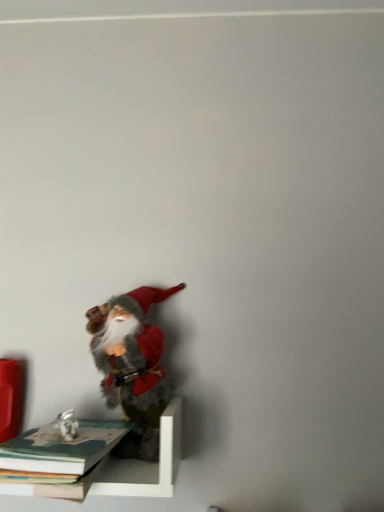
Question: From a real-world perspective, does fuzzy felt santa at lower left stand above hardcover book at lower left, positioned as the first book in bottom-to-top order?

Choices:
 (A) yes
 (B) no

Answer: (A)

Question: From the image's perspective, would you say fuzzy felt santa at lower left is positioned over hardcover book at lower left, positioned as the first book in bottom-to-top order?

Choices:
 (A) yes
 (B) no

Answer: (A)

Question: Can you confirm if fuzzy felt santa at lower left is taller than hardcover book at lower left, positioned as the first book in bottom-to-top order?

Choices:
 (A) no
 (B) yes

Answer: (B)

Question: Is fuzzy felt santa at lower left closer to camera compared to hardcover book at lower left, which is the second book from top to bottom?

Choices:
 (A) yes
 (B) no

Answer: (B)

Question: Is the position of fuzzy felt santa at lower left more distant than that of hardcover book at lower left, which is the second book from top to bottom?

Choices:
 (A) no
 (B) yes

Answer: (B)

Question: Looking at the image, does fuzzy felt santa at lower left seem bigger or smaller compared to hardcover book at lower left, which appears as the second book when ordered from the bottom?

Choices:
 (A) small
 (B) big

Answer: (B)

Question: From a real-world perspective, is fuzzy felt santa at lower left positioned above or below hardcover book at lower left, which ranks as the 1th book in top-to-bottom order?

Choices:
 (A) above
 (B) below

Answer: (A)

Question: Looking at their shapes, would you say fuzzy felt santa at lower left is wider or thinner than hardcover book at lower left, which appears as the second book when ordered from the bottom?

Choices:
 (A) wide
 (B) thin

Answer: (B)

Question: Considering the positions of fuzzy felt santa at lower left and hardcover book at lower left, which appears as the second book when ordered from the bottom, in the image, is fuzzy felt santa at lower left taller or shorter than hardcover book at lower left, which appears as the second book when ordered from the bottom,?

Choices:
 (A) tall
 (B) short

Answer: (A)

Question: From the image's perspective, relative to hardcover book at lower left, which appears as the second book when ordered from the bottom, is white matte shelf at lower left above or below?

Choices:
 (A) above
 (B) below

Answer: (B)

Question: Is white matte shelf at lower left to the left or to the right of hardcover book at lower left, which ranks as the 1th book in top-to-bottom order, in the image?

Choices:
 (A) left
 (B) right

Answer: (B)

Question: Looking at the image, does white matte shelf at lower left seem bigger or smaller compared to hardcover book at lower left, which ranks as the 1th book in top-to-bottom order?

Choices:
 (A) big
 (B) small

Answer: (A)

Question: From a real-world perspective, is white matte shelf at lower left positioned above or below hardcover book at lower left, which ranks as the 1th book in top-to-bottom order?

Choices:
 (A) above
 (B) below

Answer: (B)

Question: From the image's perspective, is hardcover book at lower left, positioned as the first book in bottom-to-top order, above or below hardcover book at lower left, which ranks as the 1th book in top-to-bottom order?

Choices:
 (A) below
 (B) above

Answer: (A)

Question: Looking at their shapes, would you say hardcover book at lower left, which is the second book from top to bottom, is wider or thinner than hardcover book at lower left, which ranks as the 1th book in top-to-bottom order?

Choices:
 (A) thin
 (B) wide

Answer: (A)